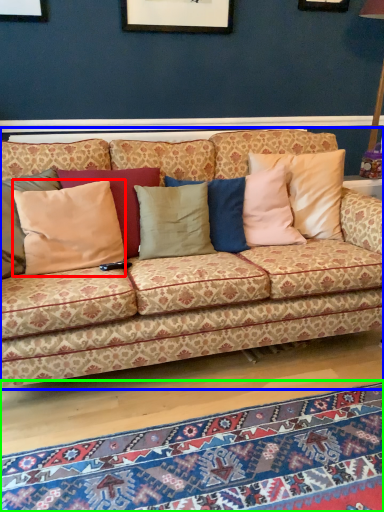
Question: Which object is the closest to the pillow (highlighted by a red box)? Choose among these: studio couch (highlighted by a blue box) or mat (highlighted by a green box).

Choices:
 (A) studio couch
 (B) mat

Answer: (A)